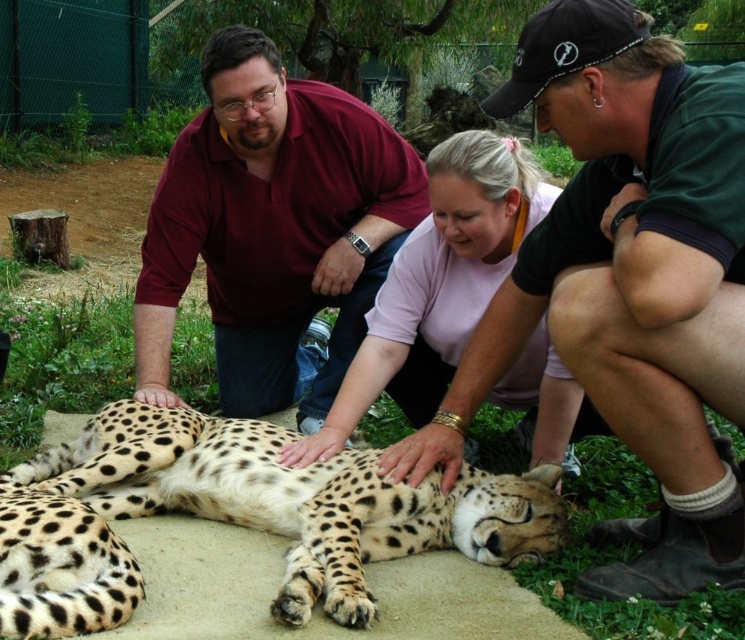
Is point (186, 276) closer to viewer compared to point (259, 477)?

No.

Is maroon shirt at upper left thinner than spotted fur cheetah at center?

Indeed, maroon shirt at upper left has a lesser width compared to spotted fur cheetah at center.

Who is more distant from viewer, (226,157) or (340,621)?

Positioned behind is point (226,157).

Identify the location of maroon shirt at upper left. The width and height of the screenshot is (745, 640). (272, 228).

Looking at this image, between green fabric cap at upper right and spotted fur cheetah at center, which one appears on the right side from the viewer's perspective?

green fabric cap at upper right

Can you confirm if green fabric cap at upper right is positioned below spotted fur cheetah at center?

Actually, green fabric cap at upper right is above spotted fur cheetah at center.

Who is more forward, (714, 304) or (69, 461)?

Point (714, 304)

You are a GUI agent. You are given a task and a screenshot of the screen. Output one action in this format:
    pyautogui.click(x=<x>, y=<y>)
    Task: Click on the green fabric cap at upper right
    This screenshot has height=640, width=745.
    Given the screenshot: What is the action you would take?
    pyautogui.click(x=627, y=276)

Is green fabric cap at upper right closer to camera compared to maroon shirt at upper left?

Yes, it is.

Can you confirm if green fabric cap at upper right is positioned below maroon shirt at upper left?

Yes.

Is point (706, 401) closer to viewer compared to point (278, 406)?

That is True.

Identify the location of green fabric cap at upper right. (627, 276).